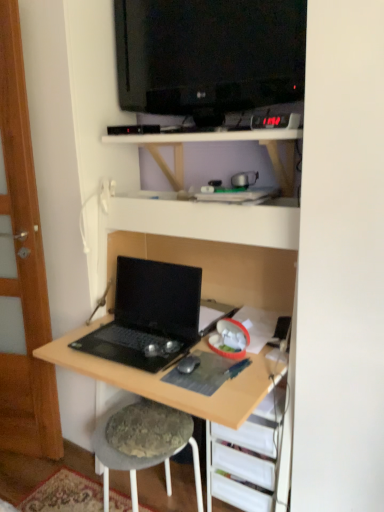
Question: Is black glossy television at upper center with black matte mouse at center?

Choices:
 (A) yes
 (B) no

Answer: (B)

Question: Can you confirm if black glossy television at upper center is smaller than black matte mouse at center?

Choices:
 (A) yes
 (B) no

Answer: (B)

Question: Considering the relative sizes of black glossy television at upper center and black matte mouse at center in the image provided, is black glossy television at upper center bigger than black matte mouse at center?

Choices:
 (A) yes
 (B) no

Answer: (A)

Question: Is black glossy television at upper center closer to the viewer compared to black matte mouse at center?

Choices:
 (A) yes
 (B) no

Answer: (A)

Question: Would you say black glossy television at upper center is outside black matte mouse at center?

Choices:
 (A) no
 (B) yes

Answer: (B)

Question: Is black glossy television at upper center facing away from black matte mouse at center?

Choices:
 (A) no
 (B) yes

Answer: (A)

Question: Can black matte laptop at lower left be found inside white matte shelf at upper center, placed as the first shelf when sorted from top to bottom?

Choices:
 (A) yes
 (B) no

Answer: (B)

Question: Is white matte shelf at upper center, placed as the second shelf when sorted from bottom to top, turned away from black matte laptop at lower left?

Choices:
 (A) no
 (B) yes

Answer: (A)

Question: Could you tell me if white matte shelf at upper center, placed as the second shelf when sorted from bottom to top, is facing black matte laptop at lower left?

Choices:
 (A) yes
 (B) no

Answer: (B)

Question: From a real-world perspective, is white matte shelf at upper center, placed as the second shelf when sorted from bottom to top, positioned under black matte laptop at lower left based on gravity?

Choices:
 (A) yes
 (B) no

Answer: (B)

Question: From the image's perspective, is white matte shelf at upper center, placed as the first shelf when sorted from top to bottom, beneath black matte laptop at lower left?

Choices:
 (A) yes
 (B) no

Answer: (B)

Question: Considering the relative sizes of white matte shelf at upper center, placed as the second shelf when sorted from bottom to top, and black matte laptop at lower left in the image provided, is white matte shelf at upper center, placed as the second shelf when sorted from bottom to top, thinner than black matte laptop at lower left?

Choices:
 (A) no
 (B) yes

Answer: (A)

Question: Would you say black glossy television at upper center is a long distance from transparent wood door at left?

Choices:
 (A) yes
 (B) no

Answer: (B)